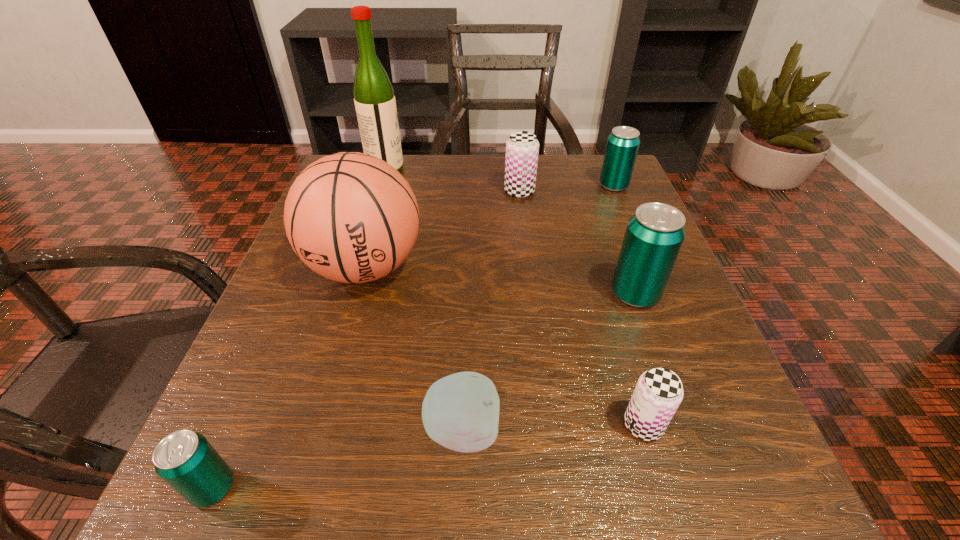
Where is `object at the near left corner`? The width and height of the screenshot is (960, 540). object at the near left corner is located at coordinates (185, 460).

The image size is (960, 540). What are the coordinates of `object that is at the far right corner` in the screenshot? It's located at (623, 143).

What are the coordinates of `vacant space at the far edge` in the screenshot? It's located at (499, 187).

Where is `vacant space at the near edge of the desktop`? vacant space at the near edge of the desktop is located at coordinates (388, 494).

Identify the location of vacant space at the left edge of the desktop. (322, 297).

In the image, there is a desktop. Where is `vacant space at the right edge`? This screenshot has height=540, width=960. vacant space at the right edge is located at coordinates (630, 332).

Locate an element on the screen. The height and width of the screenshot is (540, 960). vacant position at the near left corner of the desktop is located at coordinates (171, 509).

What are the coordinates of `free spot at the near right corner of the desktop` in the screenshot? It's located at (669, 509).

The image size is (960, 540). Find the location of `free spot between the white apple and the third tallest object`. free spot between the white apple and the third tallest object is located at coordinates (549, 362).

This screenshot has height=540, width=960. In order to click on vacant area between the smallest teal beer can and the basketball in this screenshot , I will do `click(289, 377)`.